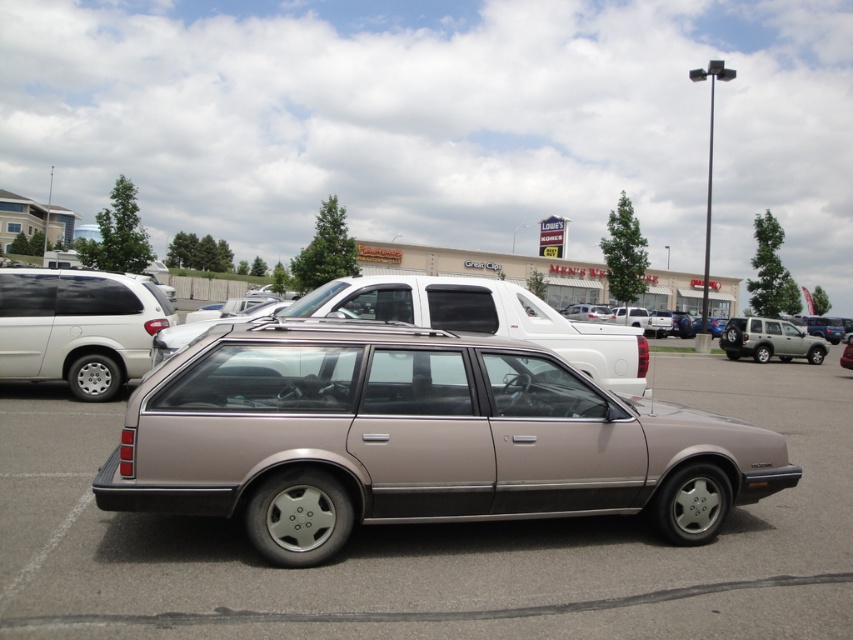
You are a delivery driver who needs to park your truck in this parking lot. You see the matte black minivan at left and the metallic gold station wagon at center. Which vehicle takes up less space in the parking spot?

The matte black minivan at left is smaller than the metallic gold station wagon at center, so it takes up less space in the parking spot.

You are standing next to a camera and want to take a photo of the metallic gray station wagon at center. The camera requires you to be at least 3 meters away from the subject to focus properly. Can you take the photo without moving?

The metallic gray station wagon at center and camera are 3.24 meters apart, so yes, you can take the photo without moving because the distance is sufficient for the camera to focus properly.